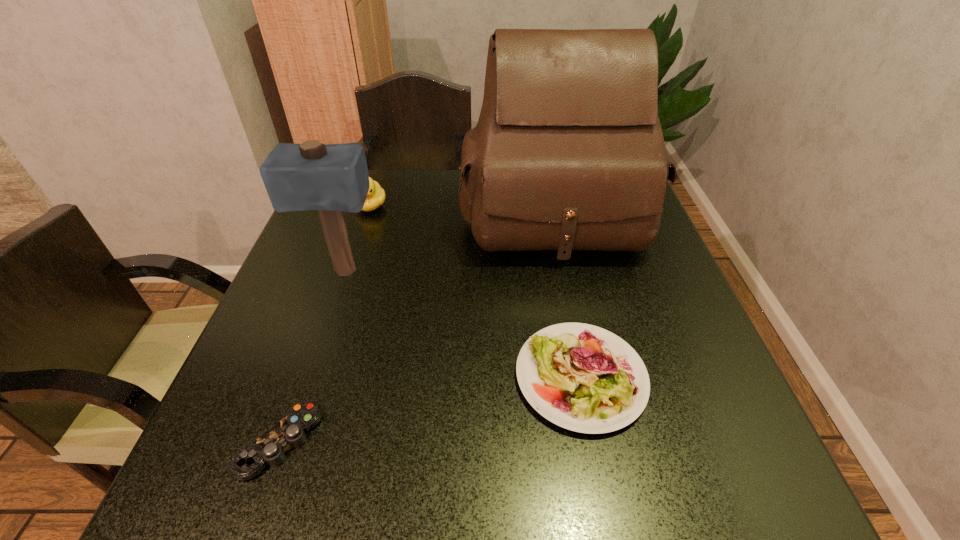
At what (x,y) coordinates should I click in order to perform the action: click on object that is at the far right corner. Please return your answer as a coordinate pair (x, y). This screenshot has width=960, height=540. Looking at the image, I should click on pyautogui.click(x=568, y=153).

This screenshot has height=540, width=960. In the image, there is a desktop. What are the coordinates of `vacant space at the far edge` in the screenshot? It's located at (420, 178).

Where is `free space at the near edge of the desktop`? The height and width of the screenshot is (540, 960). free space at the near edge of the desktop is located at coordinates [x=303, y=465].

Where is `vacant space at the left edge of the desktop`? This screenshot has height=540, width=960. vacant space at the left edge of the desktop is located at coordinates (316, 285).

The height and width of the screenshot is (540, 960). Identify the location of vacant space at the right edge of the desktop. point(709,437).

Where is `free space that is in between the duckling and the fourth tallest object`? The width and height of the screenshot is (960, 540). free space that is in between the duckling and the fourth tallest object is located at coordinates (476, 292).

Identify the location of vacant area that lies between the salad plate and the third tallest object. Image resolution: width=960 pixels, height=540 pixels. (476, 292).

In order to click on free space between the salad plate and the third shortest object in this screenshot , I will do `click(476, 292)`.

The height and width of the screenshot is (540, 960). Identify the location of free space between the shortest object and the third shortest object. (325, 323).

Identify the location of empty space that is in between the second shortest object and the shortest object. (430, 409).